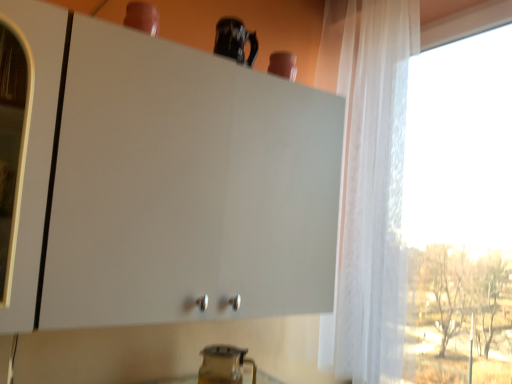
The height and width of the screenshot is (384, 512). What do you see at coordinates (185, 186) in the screenshot?
I see `white matte cabinet at upper center` at bounding box center [185, 186].

This screenshot has width=512, height=384. Describe the element at coordinates (370, 186) in the screenshot. I see `transparent curtain at right` at that location.

Locate an element on the screen. The width and height of the screenshot is (512, 384). transparent glass pitcher at lower center, the 2th appliance in the top-to-bottom sequence is located at coordinates (224, 365).

From the image's perspective, which one is positioned higher, white matte cabinet at upper center or transparent glass pitcher at lower center, the 2th appliance when ordered from front to back?

white matte cabinet at upper center.

Does white matte cabinet at upper center come behind transparent glass pitcher at lower center, the 2th appliance when ordered from front to back?

No, the depth of white matte cabinet at upper center is less than that of transparent glass pitcher at lower center, the 2th appliance when ordered from front to back.

Is white matte cabinet at upper center aimed at transparent glass pitcher at lower center, which appears as the 1th appliance when viewed from the back?

No, white matte cabinet at upper center is not facing towards transparent glass pitcher at lower center, which appears as the 1th appliance when viewed from the back.

Is white matte cabinet at upper center completely or partially outside of transparent glass pitcher at lower center, the 2th appliance in the top-to-bottom sequence?

Indeed, white matte cabinet at upper center is completely outside transparent glass pitcher at lower center, the 2th appliance in the top-to-bottom sequence.

Identify the location of appliance to the right of transparent glass pitcher at lower center, which appears as the 1th appliance when viewed from the back. (234, 41).

Which of these two, transparent glass pitcher at lower center, the first appliance in the bottom-to-top sequence, or glossy ceramic mug at upper center, the 2th appliance from the back, is thinner?

glossy ceramic mug at upper center, the 2th appliance from the back.

In the scene shown: Can you tell me how much transparent glass pitcher at lower center, which appears as the 1th appliance when viewed from the back, and glossy ceramic mug at upper center, positioned as the 2th appliance in bottom-to-top order, differ in facing direction?

1.85 degrees separate the facing orientations of transparent glass pitcher at lower center, which appears as the 1th appliance when viewed from the back, and glossy ceramic mug at upper center, positioned as the 2th appliance in bottom-to-top order.

Looking at this image, from a real-world perspective, is transparent glass pitcher at lower center, the 2th appliance when ordered from front to back, located higher than glossy ceramic mug at upper center, positioned as the 2th appliance in bottom-to-top order?

No, from a real-world perspective, transparent glass pitcher at lower center, the 2th appliance when ordered from front to back, is not over glossy ceramic mug at upper center, positioned as the 2th appliance in bottom-to-top order

Is glossy ceramic mug at upper center, positioned as the 2th appliance in bottom-to-top order, oriented away from white matte cabinet at upper center?

glossy ceramic mug at upper center, positioned as the 2th appliance in bottom-to-top order, is not turned away from white matte cabinet at upper center.

Is glossy ceramic mug at upper center, positioned as the 2th appliance in bottom-to-top order, in front of white matte cabinet at upper center?

That is False.

Locate an element on the screen. This screenshot has width=512, height=384. the 1st appliance behind the white matte cabinet at upper center is located at coordinates (234, 41).

Which is nearer, (245, 35) or (50, 300)?

Point (50, 300)

Considering the relative positions of transparent curtain at right and white matte cabinet at upper center in the image provided, is transparent curtain at right in front of white matte cabinet at upper center?

That is False.

Considering the positions of point (403, 252) and point (79, 51), is point (403, 252) closer or farther from the camera than point (79, 51)?

Point (403, 252) appears to be farther away from the viewer than point (79, 51).

Is transparent curtain at right located outside white matte cabinet at upper center?

That's correct, transparent curtain at right is outside of white matte cabinet at upper center.

Is transparent curtain at right in contact with white matte cabinet at upper center?

No.

Who is taller, white matte cabinet at upper center or transparent curtain at right?

transparent curtain at right is taller.

Is white matte cabinet at upper center oriented towards transparent curtain at right?

No, white matte cabinet at upper center does not turn towards transparent curtain at right.

Is white matte cabinet at upper center bigger or smaller than transparent curtain at right?

In the image, white matte cabinet at upper center appears to be smaller than transparent curtain at right.

How many degrees apart are the facing directions of white matte cabinet at upper center and transparent curtain at right?

89 degrees.

Is point (365, 342) farther from viewer compared to point (230, 36)?

Yes.

Is transparent curtain at right closer to camera compared to glossy ceramic mug at upper center, positioned as the 2th appliance in bottom-to-top order?

Yes, transparent curtain at right is closer to the camera.

What are the coordinates of `window located below the glossy ceramic mug at upper center, marked as the first appliance in a top-to-bottom arrangement (from the image's perspective)` in the screenshot? It's located at (370, 186).

Can you confirm if white matte cabinet at upper center is taller than glossy ceramic mug at upper center, positioned as the 2th appliance in bottom-to-top order?

Correct, white matte cabinet at upper center is much taller as glossy ceramic mug at upper center, positioned as the 2th appliance in bottom-to-top order.

Can you tell me how much white matte cabinet at upper center and glossy ceramic mug at upper center, marked as the first appliance in a top-to-bottom arrangement, differ in facing direction?

They differ by 0.153 degrees in their facing directions.

Where is `cabinetry located underneath the glossy ceramic mug at upper center, the 2th appliance from the back (from a real-world perspective)`? cabinetry located underneath the glossy ceramic mug at upper center, the 2th appliance from the back (from a real-world perspective) is located at coordinates (185, 186).

From the white matte cabinet at upper center, count 1st appliance to the right and point to it. Please provide its 2D coordinates.

[(224, 365)]

Where is `appliance located below the glossy ceramic mug at upper center, marked as the first appliance in a top-to-bottom arrangement (from the image's perspective)`? Image resolution: width=512 pixels, height=384 pixels. appliance located below the glossy ceramic mug at upper center, marked as the first appliance in a top-to-bottom arrangement (from the image's perspective) is located at coordinates (224, 365).

Considering their positions, is white matte cabinet at upper center positioned closer to glossy ceramic mug at upper center, marked as the first appliance in a top-to-bottom arrangement, than transparent curtain at right?

The object closer to glossy ceramic mug at upper center, marked as the first appliance in a top-to-bottom arrangement, is white matte cabinet at upper center.

Considering their positions, is transparent curtain at right positioned closer to white matte cabinet at upper center than glossy ceramic mug at upper center, the 1th appliance viewed from the front?

Based on the image, glossy ceramic mug at upper center, the 1th appliance viewed from the front, appears to be nearer to white matte cabinet at upper center.

Considering their positions, is transparent curtain at right positioned closer to glossy ceramic mug at upper center, positioned as the 2th appliance in bottom-to-top order, than transparent glass pitcher at lower center, the 2th appliance in the top-to-bottom sequence?

transparent curtain at right lies closer to glossy ceramic mug at upper center, positioned as the 2th appliance in bottom-to-top order, than the other object.

Based on their spatial positions, is transparent glass pitcher at lower center, which appears as the 1th appliance when viewed from the back, or white matte cabinet at upper center further from glossy ceramic mug at upper center, marked as the first appliance in a top-to-bottom arrangement?

Based on the image, transparent glass pitcher at lower center, which appears as the 1th appliance when viewed from the back, appears to be further to glossy ceramic mug at upper center, marked as the first appliance in a top-to-bottom arrangement.

Which object lies further to the anchor point transparent curtain at right, white matte cabinet at upper center or transparent glass pitcher at lower center, the 2th appliance in the top-to-bottom sequence?

transparent glass pitcher at lower center, the 2th appliance in the top-to-bottom sequence, is further to transparent curtain at right.

Considering their positions, is glossy ceramic mug at upper center, the 1th appliance viewed from the front, positioned closer to transparent glass pitcher at lower center, the first appliance in the bottom-to-top sequence, than white matte cabinet at upper center?

Among the two, white matte cabinet at upper center is located nearer to transparent glass pitcher at lower center, the first appliance in the bottom-to-top sequence.

In the scene shown: Which object lies further to the anchor point transparent curtain at right, glossy ceramic mug at upper center, marked as the first appliance in a top-to-bottom arrangement, or transparent glass pitcher at lower center, the first appliance in the bottom-to-top sequence?

Among the two, transparent glass pitcher at lower center, the first appliance in the bottom-to-top sequence, is located further to transparent curtain at right.

Considering their positions, is transparent glass pitcher at lower center, the 2th appliance in the top-to-bottom sequence, positioned further to transparent curtain at right than white matte cabinet at upper center?

transparent glass pitcher at lower center, the 2th appliance in the top-to-bottom sequence, lies further to transparent curtain at right than the other object.

Where is `window that lies between glossy ceramic mug at upper center, marked as the first appliance in a top-to-bottom arrangement, and transparent glass pitcher at lower center, the 2th appliance in the top-to-bottom sequence, from top to bottom`? The width and height of the screenshot is (512, 384). window that lies between glossy ceramic mug at upper center, marked as the first appliance in a top-to-bottom arrangement, and transparent glass pitcher at lower center, the 2th appliance in the top-to-bottom sequence, from top to bottom is located at coordinates (370, 186).

What are the coordinates of `cabinetry between glossy ceramic mug at upper center, positioned as the 2th appliance in bottom-to-top order, and transparent glass pitcher at lower center, the 2th appliance when ordered from front to back, vertically` in the screenshot? It's located at (185, 186).